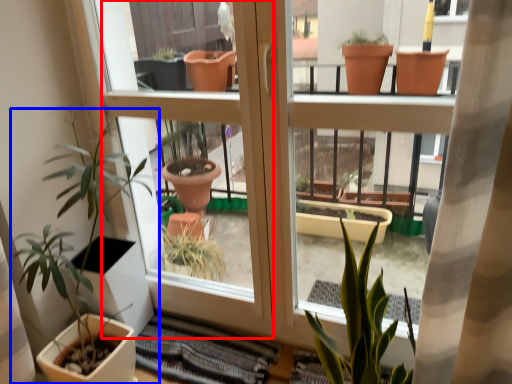
Question: Among these objects, which one is farthest to the camera, screen door (highlighted by a red box) or houseplant (highlighted by a blue box)?

Choices:
 (A) screen door
 (B) houseplant

Answer: (A)